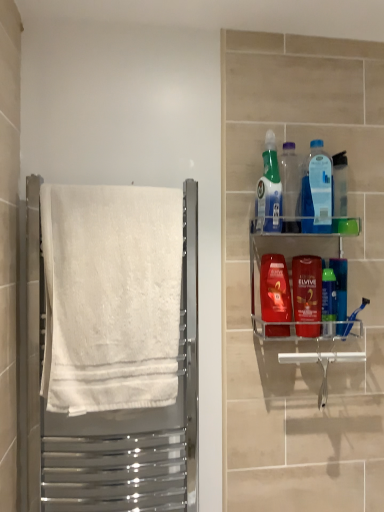
Question: Are translucent plastic spray bottle at upper right, which is counted as the 2th cleaning product, starting from the right, and transparent plastic bottle at upper center, the 1th bottle in the left-to-right sequence, making contact?

Choices:
 (A) yes
 (B) no

Answer: (A)

Question: From the image's perspective, is translucent plastic spray bottle at upper right, which appears as the 1th cleaning product when viewed from the left, under transparent plastic bottle at upper center, the 1th bottle in the left-to-right sequence?

Choices:
 (A) no
 (B) yes

Answer: (A)

Question: Is translucent plastic spray bottle at upper right, which is counted as the 2th cleaning product, starting from the right, facing towards transparent plastic bottle at upper center, the 1th bottle in the left-to-right sequence?

Choices:
 (A) yes
 (B) no

Answer: (B)

Question: Does translucent plastic spray bottle at upper right, which appears as the 1th cleaning product when viewed from the left, have a greater width compared to transparent plastic bottle at upper center, the 1th bottle in the left-to-right sequence?

Choices:
 (A) no
 (B) yes

Answer: (B)

Question: Can you confirm if translucent plastic spray bottle at upper right, which appears as the 1th cleaning product when viewed from the left, is taller than transparent plastic bottle at upper center, the 2th bottle from the right?

Choices:
 (A) no
 (B) yes

Answer: (B)

Question: Is transparent plastic bottle at upper center, the 1th bottle in the left-to-right sequence, completely or partially inside translucent plastic spray bottle at upper right, which appears as the 1th cleaning product when viewed from the left?

Choices:
 (A) yes
 (B) no

Answer: (B)

Question: Is white cotton towel at left not inside transparent plastic bottle at upper center, the 2th bottle from the right?

Choices:
 (A) yes
 (B) no

Answer: (A)

Question: Does white cotton towel at left appear on the left side of transparent plastic bottle at upper center, the 2th bottle from the right?

Choices:
 (A) no
 (B) yes

Answer: (B)

Question: Does white cotton towel at left have a lesser width compared to transparent plastic bottle at upper center, the 2th bottle from the right?

Choices:
 (A) no
 (B) yes

Answer: (A)

Question: Can you confirm if white cotton towel at left is bigger than transparent plastic bottle at upper center, the 2th bottle from the right?

Choices:
 (A) yes
 (B) no

Answer: (A)

Question: Does white cotton towel at left have a greater height compared to transparent plastic bottle at upper center, the 2th bottle from the right?

Choices:
 (A) yes
 (B) no

Answer: (A)

Question: Is the depth of white cotton towel at left less than that of transparent plastic bottle at upper center, the 2th bottle from the right?

Choices:
 (A) no
 (B) yes

Answer: (B)

Question: Is translucent blue mouthwash at center right, marked as the fourth mouthwash in a right-to-left arrangement, inside translucent plastic mouthwash at center right, which is the third mouthwash from right to left?

Choices:
 (A) no
 (B) yes

Answer: (A)